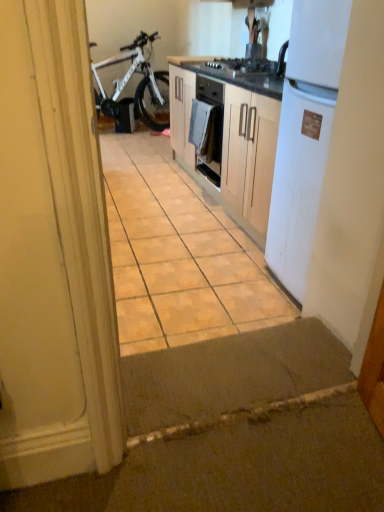
Question: Would you say white matte bicycle at left is part of brown matte tile at center's contents?

Choices:
 (A) yes
 (B) no

Answer: (B)

Question: Can you confirm if brown matte tile at center is thinner than white matte bicycle at left?

Choices:
 (A) yes
 (B) no

Answer: (B)

Question: Is brown matte tile at center bigger than white matte bicycle at left?

Choices:
 (A) yes
 (B) no

Answer: (B)

Question: Is brown matte tile at center facing away from white matte bicycle at left?

Choices:
 (A) no
 (B) yes

Answer: (A)

Question: Is brown matte tile at center beside white matte bicycle at left?

Choices:
 (A) no
 (B) yes

Answer: (A)

Question: From the image's perspective, does brown matte tile at center appear lower than white matte bicycle at left?

Choices:
 (A) no
 (B) yes

Answer: (B)

Question: Considering the relative sizes of white matte bicycle at left and brown matte tile at center in the image provided, is white matte bicycle at left thinner than brown matte tile at center?

Choices:
 (A) no
 (B) yes

Answer: (B)

Question: Does white matte bicycle at left lie in front of brown matte tile at center?

Choices:
 (A) no
 (B) yes

Answer: (A)

Question: Is white matte bicycle at left shorter than brown matte tile at center?

Choices:
 (A) yes
 (B) no

Answer: (B)

Question: From a real-world perspective, is white matte bicycle at left on brown matte tile at center?

Choices:
 (A) no
 (B) yes

Answer: (B)

Question: Is there a large distance between white matte bicycle at left and brown matte tile at center?

Choices:
 (A) no
 (B) yes

Answer: (B)

Question: From a real-world perspective, is white matte bicycle at left located beneath brown matte tile at center?

Choices:
 (A) no
 (B) yes

Answer: (A)

Question: Is brown matte tile at center positioned behind white cloth at center?

Choices:
 (A) no
 (B) yes

Answer: (A)